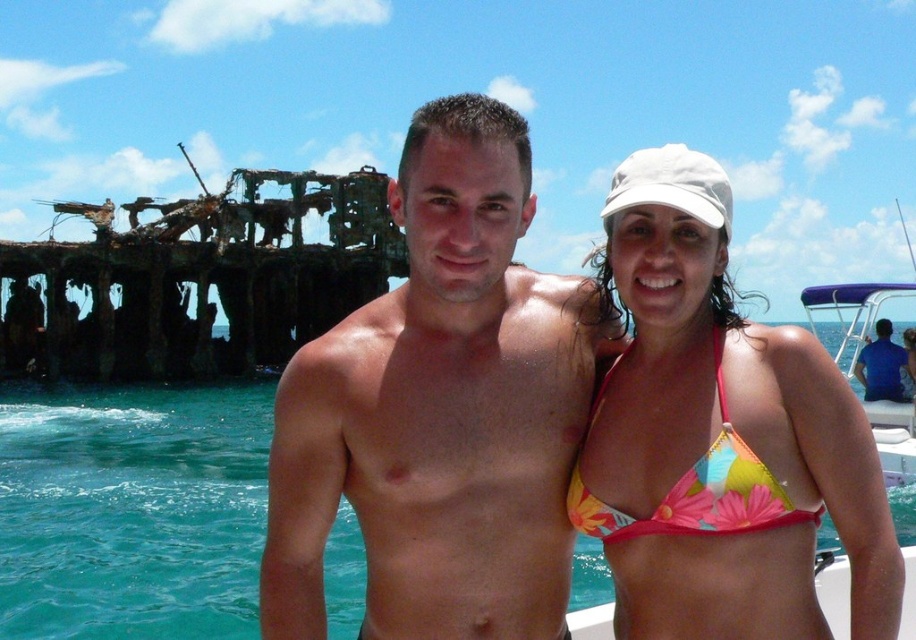
Who is shorter, rusty metal shipwreck at left or floral print bikini top at upper right?

floral print bikini top at upper right

Which is behind, point (289, 276) or point (713, 353)?

Positioned behind is point (289, 276).

Where is `rusty metal shipwreck at left`? The width and height of the screenshot is (916, 640). rusty metal shipwreck at left is located at coordinates (199, 280).

Locate an element on the screen. The height and width of the screenshot is (640, 916). rusty metal shipwreck at left is located at coordinates (199, 280).

Is clear blue water at center above purple fabric boat at right?

No.

Which is more to the left, clear blue water at center or purple fabric boat at right?

Positioned to the left is clear blue water at center.

Does point (269, 436) lie behind point (848, 355)?

Yes, it is behind point (848, 355).

Image resolution: width=916 pixels, height=640 pixels. I want to click on clear blue water at center, so click(x=131, y=509).

Between clear blue water at center and blue cotton shirt at lower right, which one has more height?

clear blue water at center is taller.

Consider the image. Is clear blue water at center to the right of blue cotton shirt at lower right from the viewer's perspective?

In fact, clear blue water at center is to the left of blue cotton shirt at lower right.

Is point (20, 561) positioned behind point (906, 396)?

No, it is in front of (906, 396).

Locate an element on the screen. clear blue water at center is located at coordinates (131, 509).